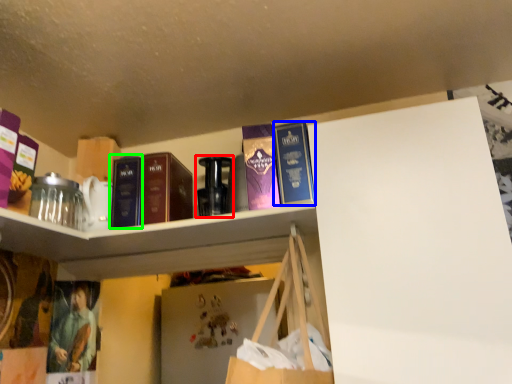
Question: Which object is positioned farthest from bottle (highlighted by a red box)? Select from book (highlighted by a blue box) and book (highlighted by a green box).

Choices:
 (A) book
 (B) book

Answer: (A)